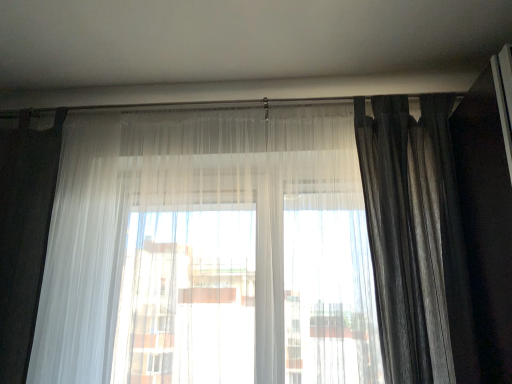
Question: Could you tell me if sheer white curtain at center, which ranks as the 2th curtain in right-to-left order, is turned towards dark gray textured curtain at right, the 2th curtain positioned from the left?

Choices:
 (A) no
 (B) yes

Answer: (A)

Question: Are sheer white curtain at center, which appears as the first curtain when viewed from the left, and dark gray textured curtain at right, which ranks as the first curtain in right-to-left order, making contact?

Choices:
 (A) yes
 (B) no

Answer: (B)

Question: Can you confirm if sheer white curtain at center, which appears as the first curtain when viewed from the left, is positioned to the left of dark gray textured curtain at right, which ranks as the first curtain in right-to-left order?

Choices:
 (A) no
 (B) yes

Answer: (B)

Question: Is sheer white curtain at center, which ranks as the 2th curtain in right-to-left order, turned away from dark gray textured curtain at right, which ranks as the first curtain in right-to-left order?

Choices:
 (A) no
 (B) yes

Answer: (A)

Question: Is the depth of sheer white curtain at center, which ranks as the 2th curtain in right-to-left order, greater than that of dark gray textured curtain at right, which ranks as the first curtain in right-to-left order?

Choices:
 (A) yes
 (B) no

Answer: (B)

Question: From a real-world perspective, is sheer white curtain at center, which ranks as the 2th curtain in right-to-left order, below dark gray textured curtain at right, the 2th curtain positioned from the left?

Choices:
 (A) no
 (B) yes

Answer: (B)

Question: Could you tell me if dark gray textured curtain at right, which ranks as the first curtain in right-to-left order, is turned towards sheer white curtain at center, which ranks as the 2th curtain in right-to-left order?

Choices:
 (A) no
 (B) yes

Answer: (A)

Question: Considering the relative positions of dark gray textured curtain at right, the 2th curtain positioned from the left, and sheer white curtain at center, which ranks as the 2th curtain in right-to-left order, in the image provided, is dark gray textured curtain at right, the 2th curtain positioned from the left, to the left of sheer white curtain at center, which ranks as the 2th curtain in right-to-left order, from the viewer's perspective?

Choices:
 (A) no
 (B) yes

Answer: (A)

Question: Would you consider dark gray textured curtain at right, which ranks as the first curtain in right-to-left order, to be distant from sheer white curtain at center, which appears as the first curtain when viewed from the left?

Choices:
 (A) yes
 (B) no

Answer: (B)

Question: Considering the relative sizes of dark gray textured curtain at right, the 2th curtain positioned from the left, and sheer white curtain at center, which appears as the first curtain when viewed from the left, in the image provided, is dark gray textured curtain at right, the 2th curtain positioned from the left, shorter than sheer white curtain at center, which appears as the first curtain when viewed from the left,?

Choices:
 (A) yes
 (B) no

Answer: (A)

Question: Does dark gray textured curtain at right, which ranks as the first curtain in right-to-left order, have a smaller size compared to sheer white curtain at center, which appears as the first curtain when viewed from the left?

Choices:
 (A) no
 (B) yes

Answer: (B)

Question: From the image's perspective, would you say dark gray textured curtain at right, which ranks as the first curtain in right-to-left order, is positioned over sheer white curtain at center, which ranks as the 2th curtain in right-to-left order?

Choices:
 (A) yes
 (B) no

Answer: (A)

Question: Looking at their shapes, would you say dark gray textured curtain at right, the 2th curtain positioned from the left, is wider or thinner than sheer white curtain at center, which appears as the first curtain when viewed from the left?

Choices:
 (A) wide
 (B) thin

Answer: (A)